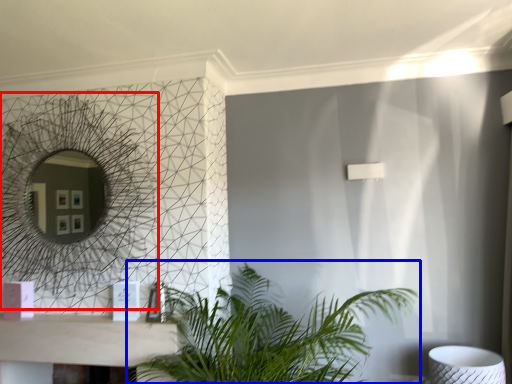
Question: Which of the following is the farthest to the observer, mirror (highlighted by a red box) or houseplant (highlighted by a blue box)?

Choices:
 (A) mirror
 (B) houseplant

Answer: (A)